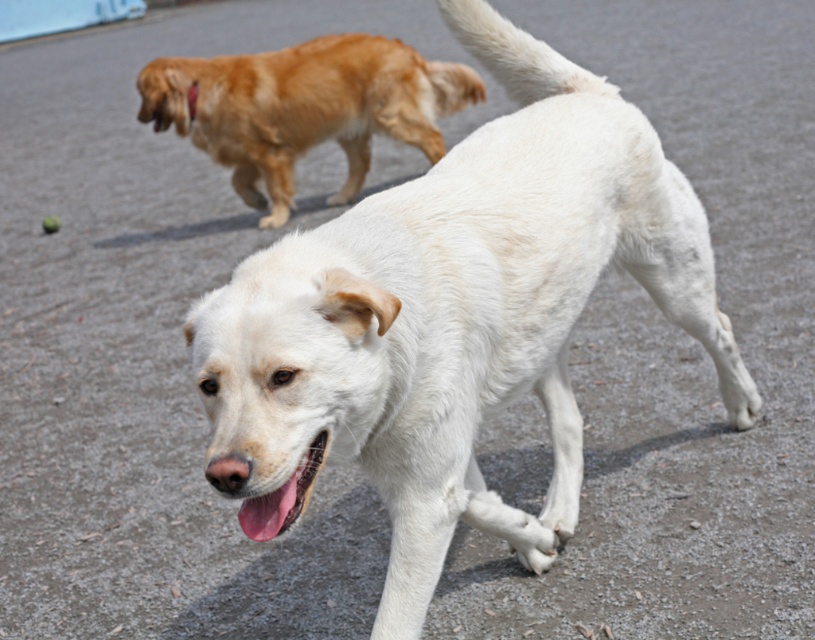
Who is higher up, white fur dog at center or pink glossy tongue at center?

white fur dog at center

Who is positioned more to the right, white fur dog at center or pink glossy tongue at center?

Positioned to the right is white fur dog at center.

Is point (567, 516) farther from camera compared to point (274, 513)?

Yes, it is behind point (274, 513).

Where is `white fur dog at center`? white fur dog at center is located at coordinates [x=456, y=314].

Who is lower down, white fur dog at center or golden fur dog at upper left?

white fur dog at center is lower down.

Which of these two, white fur dog at center or golden fur dog at upper left, stands shorter?

Standing shorter between the two is golden fur dog at upper left.

Between point (562, 248) and point (293, 52), which one is positioned behind?

The point (293, 52) is more distant.

Find the location of `white fur dog at center`. white fur dog at center is located at coordinates (456, 314).

Which of these two, golden fur dog at upper left or pink glossy tongue at center, stands shorter?

pink glossy tongue at center

Between golden fur dog at upper left and pink glossy tongue at center, which one has more height?

Standing taller between the two is golden fur dog at upper left.

Who is more distant from viewer, [371,93] or [253,518]?

The point [371,93] is behind.

Locate an element on the screen. The image size is (815, 640). golden fur dog at upper left is located at coordinates (304, 108).